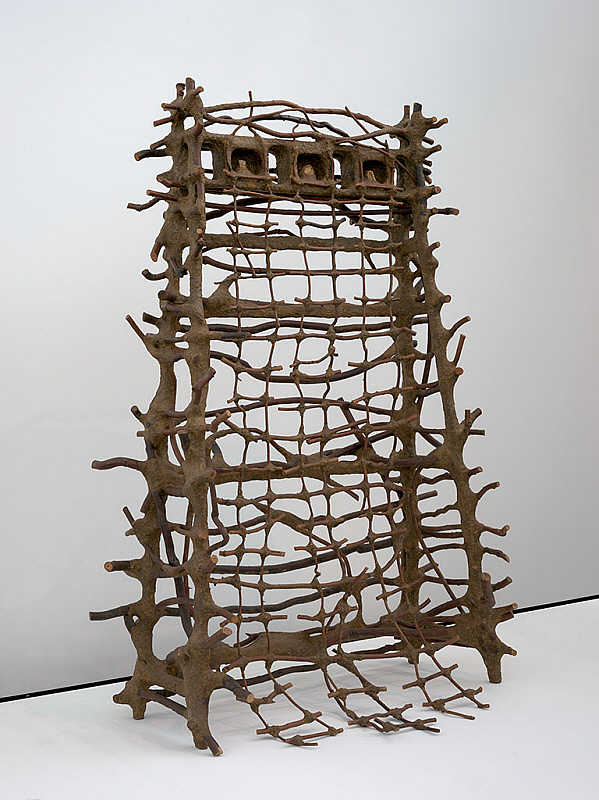
The width and height of the screenshot is (599, 800). I want to click on grey wall, so click(x=503, y=138).